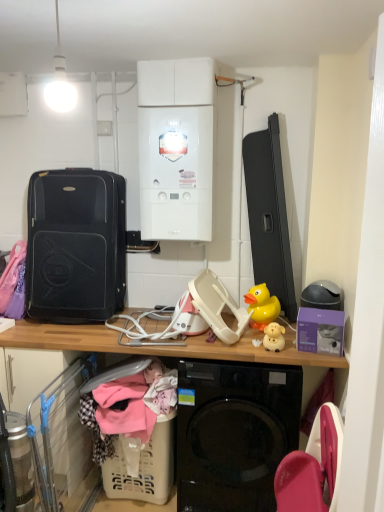
Question: From the image's perspective, does matte yellow plastic toy at center, the second toy positioned from the back, appear lower than white glossy boiler at upper center?

Choices:
 (A) no
 (B) yes

Answer: (B)

Question: Does matte yellow plastic toy at center, which is counted as the 1th toy, starting from the front, have a smaller size compared to white glossy boiler at upper center?

Choices:
 (A) yes
 (B) no

Answer: (A)

Question: Is matte yellow plastic toy at center, the second toy positioned from the back, behind white glossy boiler at upper center?

Choices:
 (A) no
 (B) yes

Answer: (A)

Question: Can you confirm if matte yellow plastic toy at center, which is counted as the 1th toy, starting from the front, is wider than white glossy boiler at upper center?

Choices:
 (A) no
 (B) yes

Answer: (A)

Question: Is matte yellow plastic toy at center, which is counted as the 1th toy, starting from the front, to the left of white glossy boiler at upper center from the viewer's perspective?

Choices:
 (A) no
 (B) yes

Answer: (A)

Question: Is matte yellow plastic toy at center, which is counted as the 1th toy, starting from the front, shorter than white glossy boiler at upper center?

Choices:
 (A) yes
 (B) no

Answer: (A)

Question: Is wooden desk at center positioned before matte yellow plastic toy at center, which is counted as the 1th toy, starting from the front?

Choices:
 (A) yes
 (B) no

Answer: (A)

Question: Is matte yellow plastic toy at center, the second toy positioned from the back, a part of wooden desk at center?

Choices:
 (A) no
 (B) yes

Answer: (A)

Question: Is wooden desk at center wider than matte yellow plastic toy at center, which is counted as the 1th toy, starting from the front?

Choices:
 (A) yes
 (B) no

Answer: (A)

Question: From a real-world perspective, is wooden desk at center located higher than matte yellow plastic toy at center, the second toy positioned from the back?

Choices:
 (A) yes
 (B) no

Answer: (B)

Question: Could you tell me if wooden desk at center is facing matte yellow plastic toy at center, which is counted as the 1th toy, starting from the front?

Choices:
 (A) no
 (B) yes

Answer: (A)

Question: Is there a large distance between wooden desk at center and matte yellow plastic toy at center, the second toy positioned from the back?

Choices:
 (A) no
 (B) yes

Answer: (A)

Question: Are beige plastic laundry basket at lower left and wooden desk at center making contact?

Choices:
 (A) no
 (B) yes

Answer: (A)